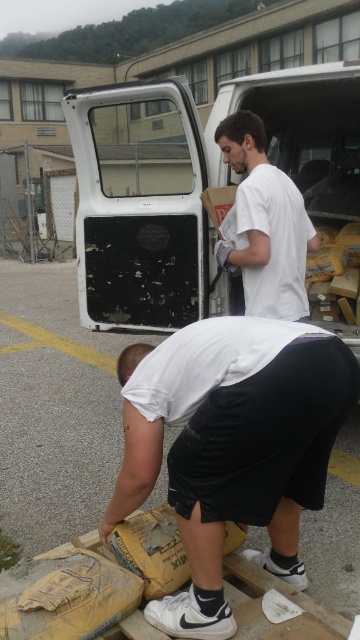
You are standing at the point labeled as point (194, 184) in the image. What object are you touching?

The point (194, 184) is on the white matte truck door at upper center, so you are touching the white matte truck door at upper center.